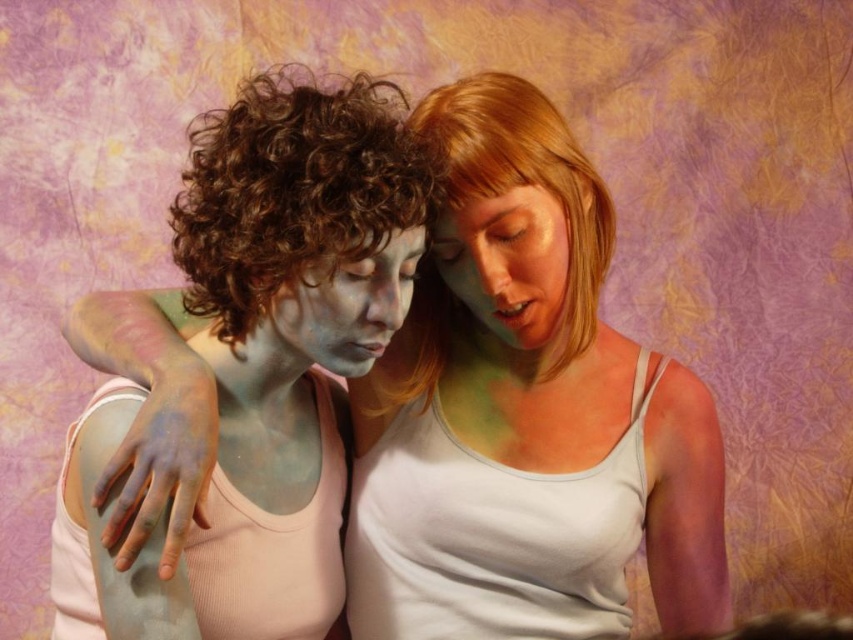
Can you confirm if green matte face at center is thinner than matte paint face at center?

Indeed, green matte face at center has a lesser width compared to matte paint face at center.

Does point (503, 342) lie behind point (318, 296)?

Yes, it is behind point (318, 296).

This screenshot has height=640, width=853. I want to click on green matte face at center, so click(508, 264).

This screenshot has height=640, width=853. Identify the location of green matte face at center. (508, 264).

Does point (440, 547) come farther from viewer compared to point (463, 269)?

Yes.

What do you see at coordinates (525, 410) in the screenshot? The height and width of the screenshot is (640, 853). I see `matte painted face at center` at bounding box center [525, 410].

This screenshot has height=640, width=853. I want to click on matte painted face at center, so click(525, 410).

Who is more distant from viewer, (166, 364) or (381, 284)?

Positioned behind is point (381, 284).

Find the location of a particular element. This screenshot has width=853, height=640. matte painted face at center is located at coordinates (525, 410).